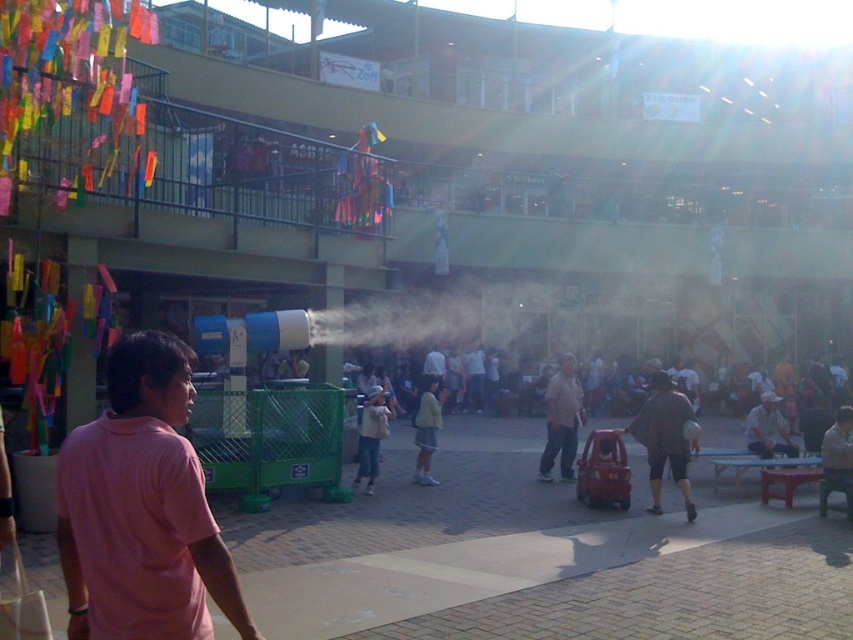
Is pink cotton shirt at center thinner than light yellow fabric at center?

In fact, pink cotton shirt at center might be wider than light yellow fabric at center.

Is pink cotton shirt at center to the right of light yellow fabric at center from the viewer's perspective?

No, pink cotton shirt at center is not to the right of light yellow fabric at center.

The image size is (853, 640). I want to click on pink cotton shirt at center, so click(142, 509).

This screenshot has width=853, height=640. I want to click on pink cotton shirt at center, so click(142, 509).

Between light brown fabric shirt at center and light yellow fabric at center, which one has less height?

light yellow fabric at center is shorter.

Is point (369, 413) closer to viewer compared to point (416, 436)?

Yes, it is.

Identify the location of light brown fabric shirt at center. Image resolution: width=853 pixels, height=640 pixels. (370, 436).

Is dark gray fabric shirt at center positioned behind light brown cotton shirt at center?

No, it is in front of light brown cotton shirt at center.

Is dark gray fabric shirt at center thinner than light brown cotton shirt at center?

Indeed, dark gray fabric shirt at center has a lesser width compared to light brown cotton shirt at center.

Where is `dark gray fabric shirt at center`? The image size is (853, 640). dark gray fabric shirt at center is located at coordinates (665, 438).